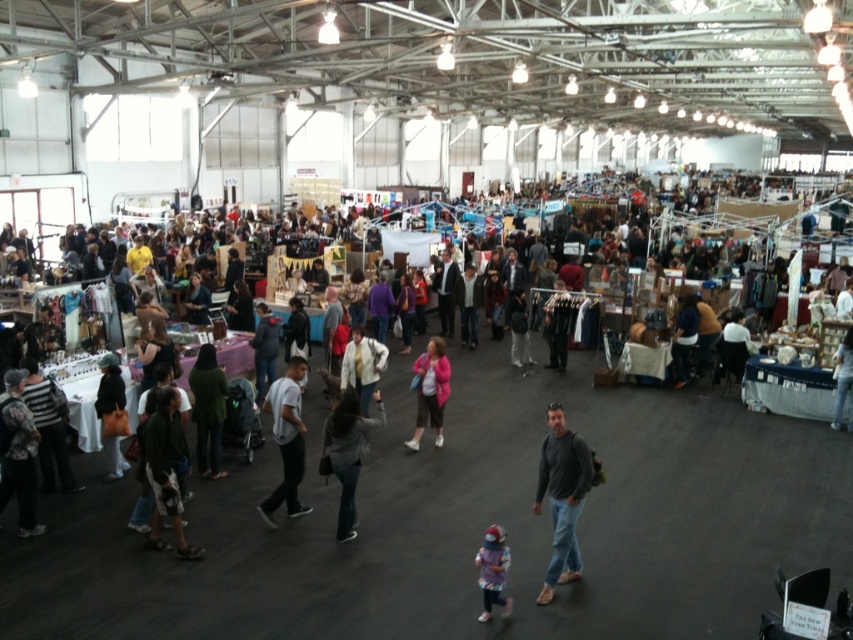
Who is more distant from viewer, (440,426) or (488,589)?

Positioned behind is point (440,426).

Which is below, pink fabric jacket at center or purple fuzzy hat at center?

purple fuzzy hat at center is lower down.

Find the location of a particular element. pink fabric jacket at center is located at coordinates (430, 390).

This screenshot has width=853, height=640. I want to click on pink fabric jacket at center, so click(430, 390).

Who is more distant from viewer, (300, 420) or (380, 356)?

Positioned behind is point (300, 420).

Who is taller, gray cotton shirt at center or white cotton jacket at center?

With more height is gray cotton shirt at center.

Is point (270, 497) positioned before point (357, 340)?

Yes, point (270, 497) is closer to viewer.

Where is `gray cotton shirt at center`? gray cotton shirt at center is located at coordinates (286, 440).

Consider the image. Who is shorter, dark gray sweater at center or dark gray fabric jacket at lower left?

dark gray fabric jacket at lower left is shorter.

Can you confirm if dark gray sweater at center is smaller than dark gray fabric jacket at lower left?

Incorrect, dark gray sweater at center is not smaller in size than dark gray fabric jacket at lower left.

What do you see at coordinates (347, 452) in the screenshot? I see `dark gray sweater at center` at bounding box center [347, 452].

Locate an element on the screen. The height and width of the screenshot is (640, 853). dark gray sweater at center is located at coordinates (347, 452).